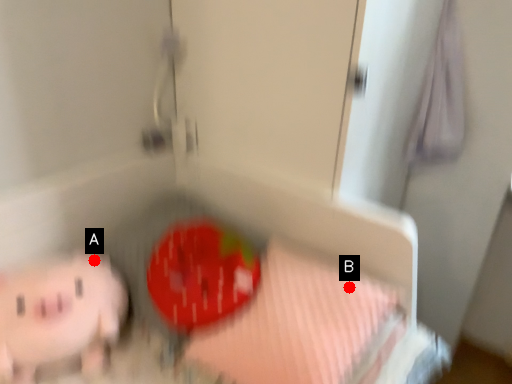
Question: Two points are circled on the image, labeled by A and B beside each circle. Which of the following is the farthest from the observer?

Choices:
 (A) A is further
 (B) B is further

Answer: (A)